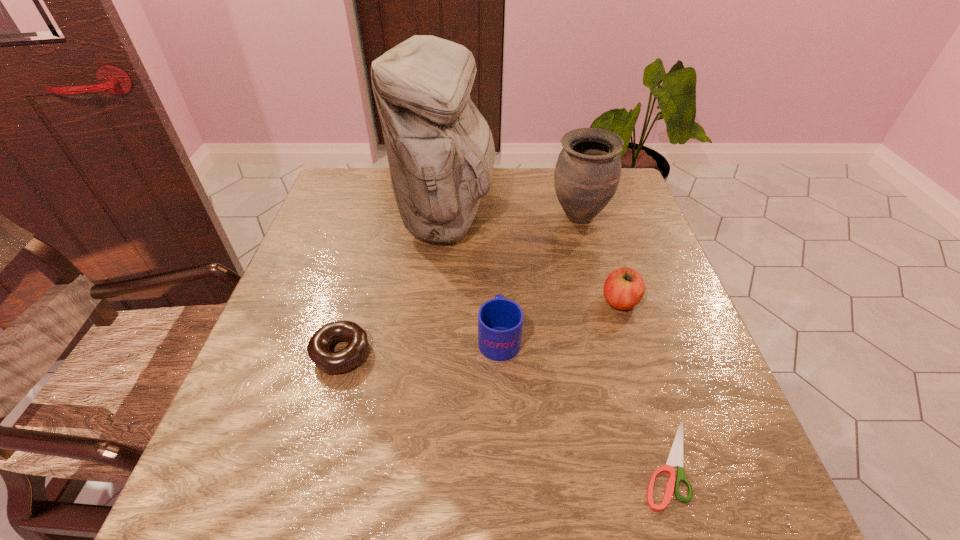
Locate an element on the screen. the tallest object is located at coordinates (440, 149).

What are the coordinates of `the fifth shortest object` in the screenshot? It's located at (x=587, y=173).

This screenshot has height=540, width=960. I want to click on mug, so pyautogui.click(x=500, y=320).

Find the location of a particular element. Image resolution: width=960 pixels, height=540 pixels. apple is located at coordinates (624, 288).

Where is `doughnut`? The height and width of the screenshot is (540, 960). doughnut is located at coordinates (319, 345).

Image resolution: width=960 pixels, height=540 pixels. In order to click on scissors in this screenshot , I will do pyautogui.click(x=675, y=458).

Where is `the shortest object`? the shortest object is located at coordinates (675, 458).

The image size is (960, 540). I want to click on blank area located on the front-facing side of the backpack, so click(556, 218).

This screenshot has height=540, width=960. In order to click on blank space located 0.080m on the left of the fifth shortest object in this screenshot , I will do `click(520, 218)`.

What are the coordinates of `blank space located on the side with the handle of the mug` in the screenshot? It's located at (494, 228).